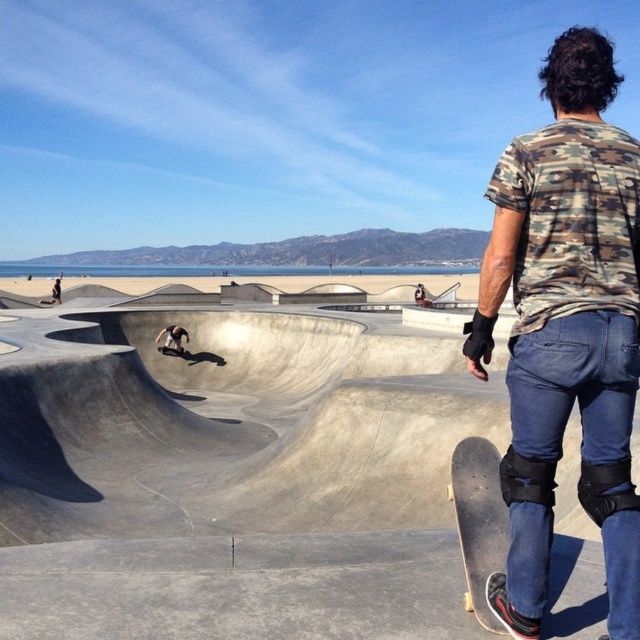
Describe the element at coordinates (477, 522) in the screenshot. This screenshot has height=640, width=640. I see `black matte skateboard at lower right` at that location.

Is black matte skateboard at lower right shorter than matte black skateboard at center?

In fact, black matte skateboard at lower right may be taller than matte black skateboard at center.

Where is `black matte skateboard at lower right`? The image size is (640, 640). black matte skateboard at lower right is located at coordinates (477, 522).

Who is lower down, camo fabric shirt at upper right or black smooth skateboard at center?

Positioned lower is black smooth skateboard at center.

At what (x,y) coordinates should I click in order to perform the action: click on camo fabric shirt at upper right. Please return your answer as a coordinate pair (x, y). Looking at the image, I should click on (566, 328).

Image resolution: width=640 pixels, height=640 pixels. What are the coordinates of `camo fabric shirt at upper right` in the screenshot? It's located at (566, 328).

Is matte black skateboard at center smaller than black smooth skateboard at center?

Incorrect, matte black skateboard at center is not smaller in size than black smooth skateboard at center.

Is matte black skateboard at center below black smooth skateboard at center?

Incorrect, matte black skateboard at center is not positioned below black smooth skateboard at center.

The image size is (640, 640). I want to click on matte black skateboard at center, so click(172, 339).